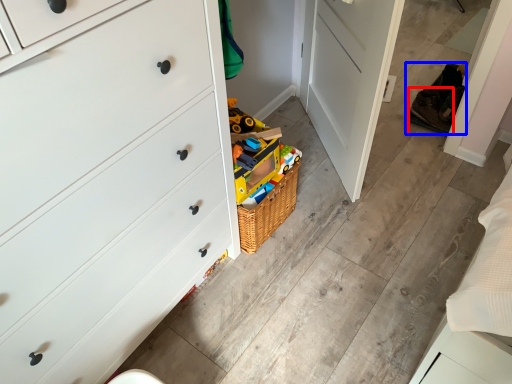
Question: Which of the following is the closest to the observer, shoe (highlighted by a red box) or shoe (highlighted by a blue box)?

Choices:
 (A) shoe
 (B) shoe

Answer: (A)